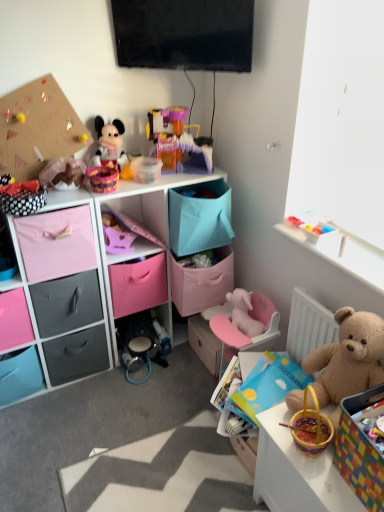
Question: Could you tell me if pink fabric drawer at left, the third drawer viewed from the right, is turned towards fluffy beige teddy bear at right?

Choices:
 (A) yes
 (B) no

Answer: (B)

Question: From a real-world perspective, is pink fabric drawer at left, which appears as the fifth drawer when viewed from the left, positioned over fluffy beige teddy bear at right based on gravity?

Choices:
 (A) no
 (B) yes

Answer: (B)

Question: Is pink fabric drawer at left, the third drawer viewed from the right, positioned before fluffy beige teddy bear at right?

Choices:
 (A) no
 (B) yes

Answer: (A)

Question: Does pink fabric drawer at left, which appears as the fifth drawer when viewed from the left, have a smaller size compared to fluffy beige teddy bear at right?

Choices:
 (A) no
 (B) yes

Answer: (A)

Question: Is pink fabric drawer at left, the third drawer viewed from the right, directly adjacent to fluffy beige teddy bear at right?

Choices:
 (A) no
 (B) yes

Answer: (A)

Question: Does pink fabric drawer at left, which appears as the fifth drawer when viewed from the left, have a greater height compared to fluffy beige teddy bear at right?

Choices:
 (A) yes
 (B) no

Answer: (B)

Question: From the image's perspective, would you say pink plush elephant at center, acting as the fourth toy starting from the top, is positioned over fluffy beige teddy bear at right?

Choices:
 (A) no
 (B) yes

Answer: (B)

Question: Does pink plush elephant at center, acting as the fourth toy starting from the top, contain fluffy beige teddy bear at right?

Choices:
 (A) no
 (B) yes

Answer: (A)

Question: Is pink plush elephant at center, which ranks as the first toy in right-to-left order, shorter than fluffy beige teddy bear at right?

Choices:
 (A) no
 (B) yes

Answer: (B)

Question: Does pink plush elephant at center, the 4th toy positioned from the left, have a greater width compared to fluffy beige teddy bear at right?

Choices:
 (A) yes
 (B) no

Answer: (A)

Question: Considering the relative positions of pink plush elephant at center, acting as the fourth toy starting from the top, and fluffy beige teddy bear at right in the image provided, is pink plush elephant at center, acting as the fourth toy starting from the top, to the right of fluffy beige teddy bear at right from the viewer's perspective?

Choices:
 (A) no
 (B) yes

Answer: (A)

Question: Is pink plush elephant at center, the 4th toy positioned from the left, facing away from fluffy beige teddy bear at right?

Choices:
 (A) no
 (B) yes

Answer: (A)

Question: Considering the relative sizes of matte black drawer at lower left, the 4th drawer in the left-to-right sequence, and pink fabric drawer at lower left, which ranks as the 6th drawer in right-to-left order, in the image provided, is matte black drawer at lower left, the 4th drawer in the left-to-right sequence, shorter than pink fabric drawer at lower left, which ranks as the 6th drawer in right-to-left order,?

Choices:
 (A) no
 (B) yes

Answer: (B)